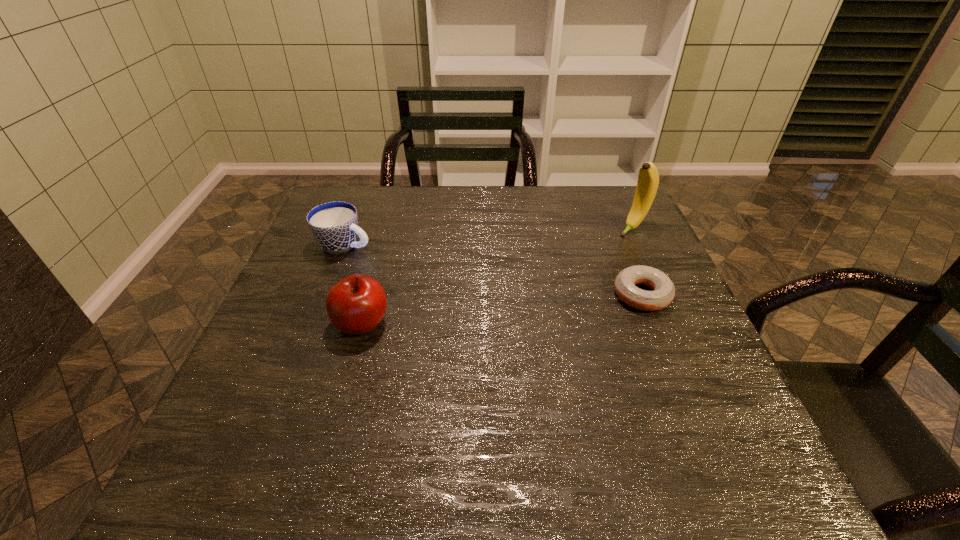
Find the location of a particular element. The image size is (960, 540). free space located on the side of the cup with the handle is located at coordinates (492, 290).

The image size is (960, 540). What are the coordinates of `vacant point located on the side of the cup with the handle` in the screenshot? It's located at (411, 264).

Identify the location of object located in the far edge section of the desktop. (648, 179).

The image size is (960, 540). Find the location of `apple present at the left edge`. apple present at the left edge is located at coordinates click(356, 304).

Where is `cup present at the left edge`? The width and height of the screenshot is (960, 540). cup present at the left edge is located at coordinates (334, 225).

This screenshot has height=540, width=960. I want to click on doughnut positioned at the right edge, so click(664, 291).

Locate an element on the screen. banana at the right edge is located at coordinates (648, 179).

Identify the location of object positioned at the far right corner. The height and width of the screenshot is (540, 960). (648, 179).

I want to click on free space at the far edge, so click(x=573, y=199).

At what (x,y) coordinates should I click in order to perform the action: click on blank space at the near edge of the desktop. Please return your answer as a coordinate pair (x, y). The height and width of the screenshot is (540, 960). Looking at the image, I should click on (514, 423).